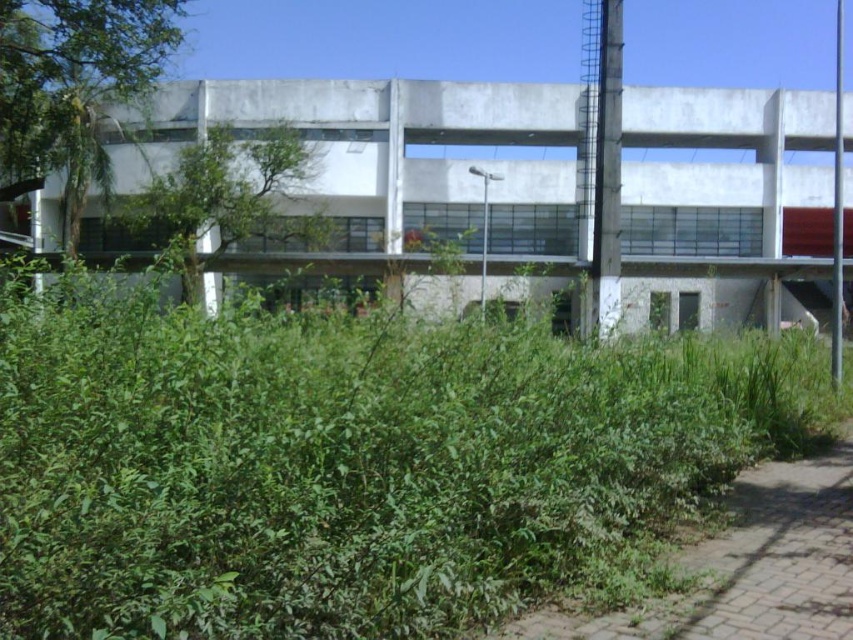
Does green leafy bush at center come in front of green grass at lower right?

Yes, it is in front of green grass at lower right.

Is green leafy bush at center wider than green grass at lower right?

Yes, green leafy bush at center is wider than green grass at lower right.

Describe the element at coordinates (352, 460) in the screenshot. I see `green leafy bush at center` at that location.

Find the location of a particular element. green leafy bush at center is located at coordinates (352, 460).